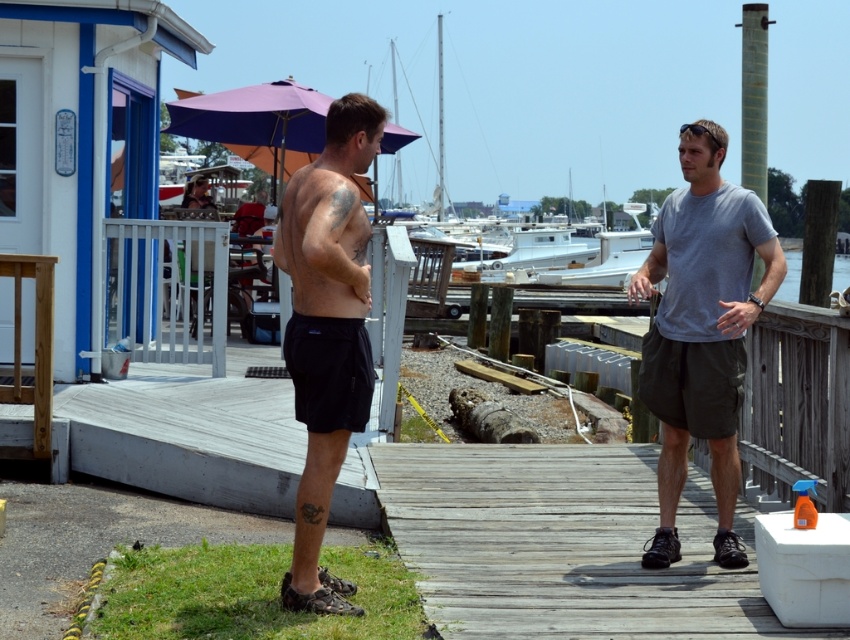
Question: Is white fiberglass boat at center above white glossy boat at center?

Choices:
 (A) no
 (B) yes

Answer: (B)

Question: Is weathered wood dock at center positioned at the back of purple fabric umbrella at upper center?

Choices:
 (A) no
 (B) yes

Answer: (A)

Question: Can you confirm if white fiberglass boat at center is positioned above purple fabric umbrella at upper center?

Choices:
 (A) no
 (B) yes

Answer: (B)

Question: Which object is farther from the camera taking this photo?

Choices:
 (A) white fiberglass boat at center
 (B) gray cotton t-shirt at right

Answer: (A)

Question: Which of the following is the closest to the observer?

Choices:
 (A) (639, 570)
 (B) (217, 104)
 (C) (332, 355)
 (D) (598, 154)

Answer: (C)

Question: Among these points, which one is farthest from the camera?

Choices:
 (A) (180, 100)
 (B) (332, 294)
 (C) (717, 448)
 (D) (837, 282)

Answer: (D)